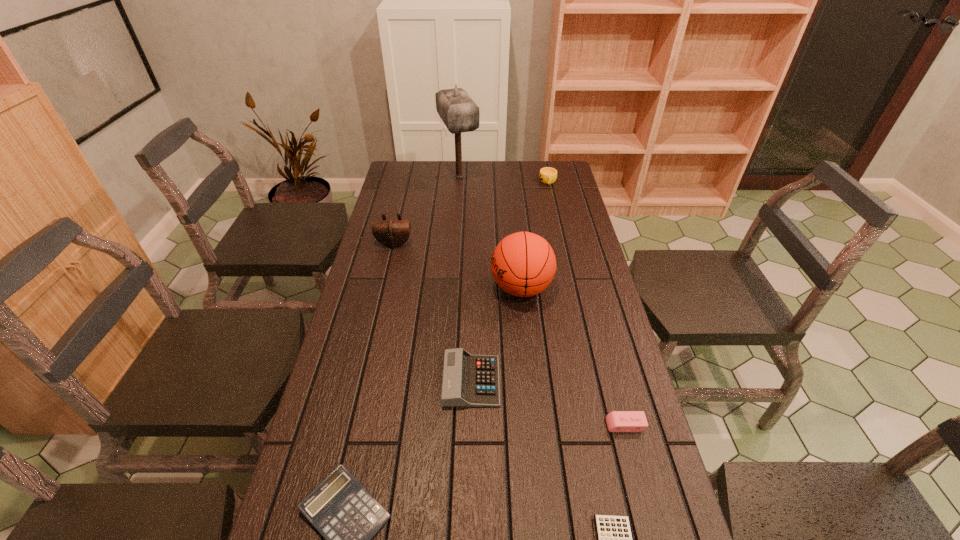
Locate an element on the screen. Image resolution: width=960 pixels, height=540 pixels. free space between the sixth farthest object and the mallet is located at coordinates (542, 301).

Identify the location of vacant space that's between the mallet and the eraser. This screenshot has width=960, height=540. 542,301.

You are a GUI agent. You are given a task and a screenshot of the screen. Output one action in this format:
    pyautogui.click(x=<x>, y=<y>)
    Task: Click on the free space between the cup and the third farthest object
    The width and height of the screenshot is (960, 540).
    Given the screenshot: What is the action you would take?
    pyautogui.click(x=471, y=213)

Find the location of a particular element. This screenshot has height=540, width=960. object that is the seventh closest to the cup is located at coordinates (614, 535).

Identify which object is located as the seventh nearest to the leftmost calculator. Please provide its 2D coordinates. Your answer should be formatted as a tuple, i.e. [(x, y)], where the tuple contains the x and y coordinates of a point satisfying the conditions above.

[(547, 175)]

The image size is (960, 540). I want to click on the third closest calculator to the basketball, so click(614, 535).

Locate an element on the screen. the second closest calculator relative to the leftmost calculator is located at coordinates [614, 535].

Find the location of a particular element. vacant region that satisfies the following two spatial constraints: 1. on the side with logo of the second tallest object; 2. on the right side of the sixth farthest object is located at coordinates (536, 425).

Identify the location of free space in the image that satisfies the following two spatial constraints: 1. on the side with logo of the fourth farthest object; 2. on the right side of the eraser. This screenshot has height=540, width=960. coord(536,425).

Image resolution: width=960 pixels, height=540 pixels. What are the coordinates of `blank area in the image that satisfies the following two spatial constraints: 1. with the flap open on the pouch; 2. on the left side of the farthest calculator` in the screenshot? It's located at (362, 381).